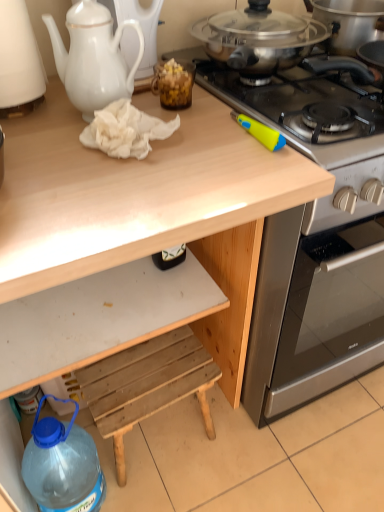
Locate an element on the screen. Image resolution: width=384 pixels, height=512 pixels. vacant region in front of white porcelain teapot at upper left is located at coordinates click(101, 170).